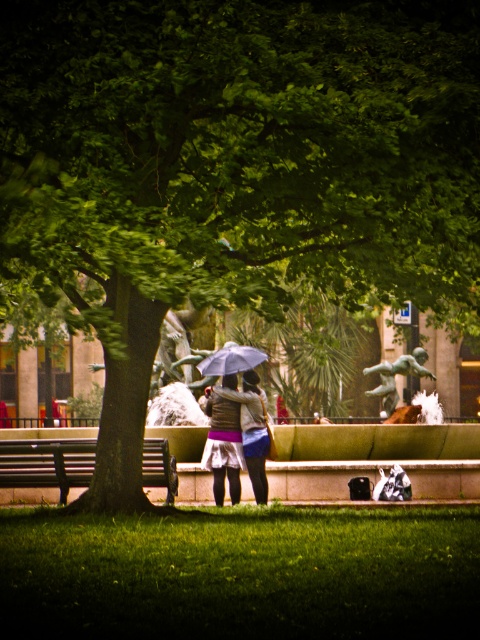
You are standing at the point labeled as point (47, 464) in the image. Looking towards the wooden bench at left, which direction should you walk to reach the blue umbrella in the midground?

Since the wooden bench at left is marked at point (47, 464), you should walk towards the right to reach the blue umbrella in the midground.

You are standing in the park and see the point at coordinates (252, 429). What object is this point located on?

The point at coordinates (252, 429) is located on the matte brown jacket at center.

You are a photographer wanting to capture a photo of the green patinated bronze statue at center from the wooden bench at left. Given that the statue is 11.33 meters away, can you estimate whether the statue will appear large enough in your photo if you use a standard 50mm lens?

The wooden bench at left is 11.33 meters from the green patinated bronze statue at center. With a standard 50mm lens, the statue would appear relatively small in the frame due to the distance, so it may not fill the photo prominently unless you use a telephoto lens for closer cropping.